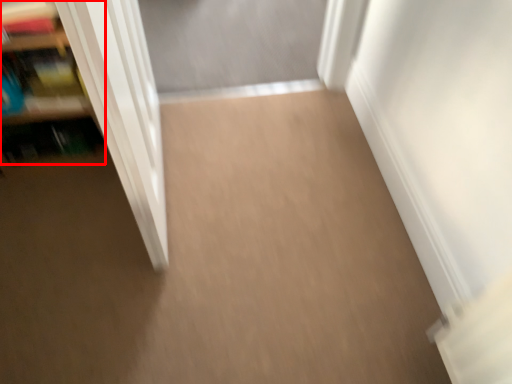
Question: Considering the relative positions of shelf (annotated by the red box) and door in the image provided, where is shelf (annotated by the red box) located with respect to the staircase?

Choices:
 (A) left
 (B) right

Answer: (A)